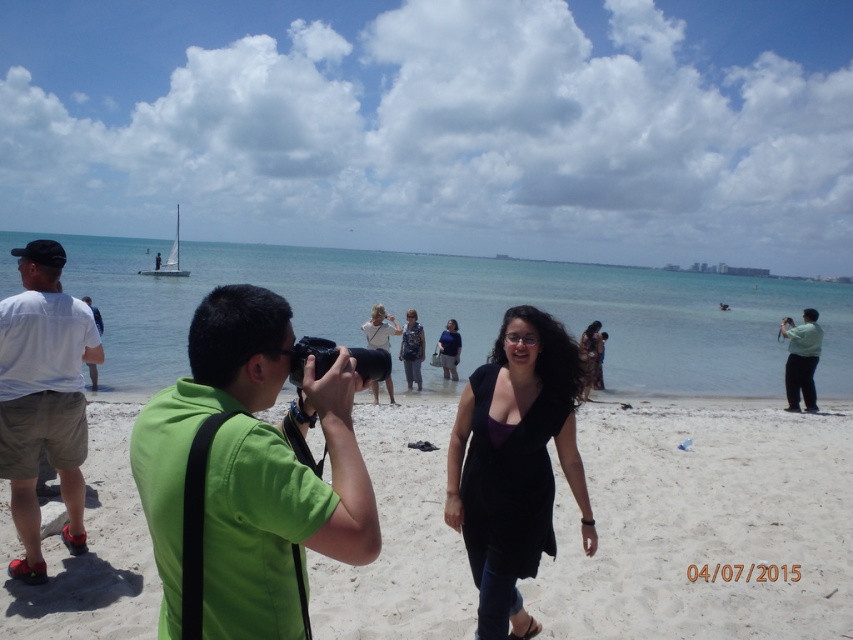
Question: Based on their relative distances, which object is farther from the white cotton shirt at left?

Choices:
 (A) green fabric shirt at right
 (B) matte white shirt at left
 (C) white cotton shirt at center
 (D) green fabric shirt at left

Answer: (A)

Question: Does green fabric shirt at left lie in front of denim jacket at center?

Choices:
 (A) yes
 (B) no

Answer: (A)

Question: Which point is farther to the camera?

Choices:
 (A) white cotton shirt at center
 (B) brown textured dress at center
 (C) matte white shirt at left

Answer: (C)

Question: Which is farther from the denim jacket at center?

Choices:
 (A) matte white shirt at left
 (B) green fabric shirt at right
 (C) white cotton shirt at center
 (D) dark blue dress at center

Answer: (B)

Question: In this image, where is green fabric shirt at left located relative to dark blue dress at center?

Choices:
 (A) left
 (B) right

Answer: (A)

Question: In this image, where is black matte dress at center located relative to matte white shirt at left?

Choices:
 (A) above
 (B) below

Answer: (B)